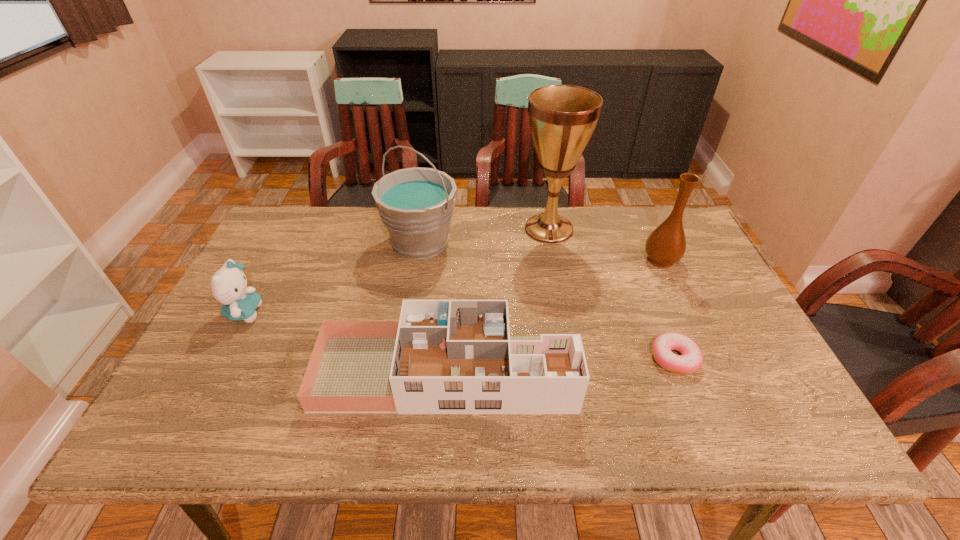
I want to click on free space located on the face of the fourth farthest object, so click(320, 313).

Find the location of a particular element. This screenshot has width=960, height=540. free space located at the front door of the dollhouse is located at coordinates (727, 373).

You are a GUI agent. You are given a task and a screenshot of the screen. Output one action in this format:
    pyautogui.click(x=<x>, y=<y>)
    Task: Click on the blank area located 0.110m on the front of the doughnut
    Image resolution: width=960 pixels, height=540 pixels.
    Given the screenshot: What is the action you would take?
    tap(699, 421)

You are a GUI agent. You are given a task and a screenshot of the screen. Output one action in this format:
    pyautogui.click(x=<x>, y=<y>)
    Task: Click on the trophy cup located in the far edge section of the desktop
    
    Given the screenshot: What is the action you would take?
    pos(562,118)

Locate an element on the screen. bucket located at the far edge is located at coordinates (416, 204).

The width and height of the screenshot is (960, 540). What are the coordinates of `vase located in the far edge section of the desktop` in the screenshot? It's located at (666, 245).

In order to click on object at the near edge in this screenshot , I will do `click(443, 356)`.

Find the location of a particular element. This screenshot has height=540, width=960. object at the left edge is located at coordinates (229, 284).

Image resolution: width=960 pixels, height=540 pixels. I want to click on vase at the right edge, so click(x=666, y=245).

Locate an element on the screen. Image resolution: width=960 pixels, height=540 pixels. doughnut located in the right edge section of the desktop is located at coordinates (690, 360).